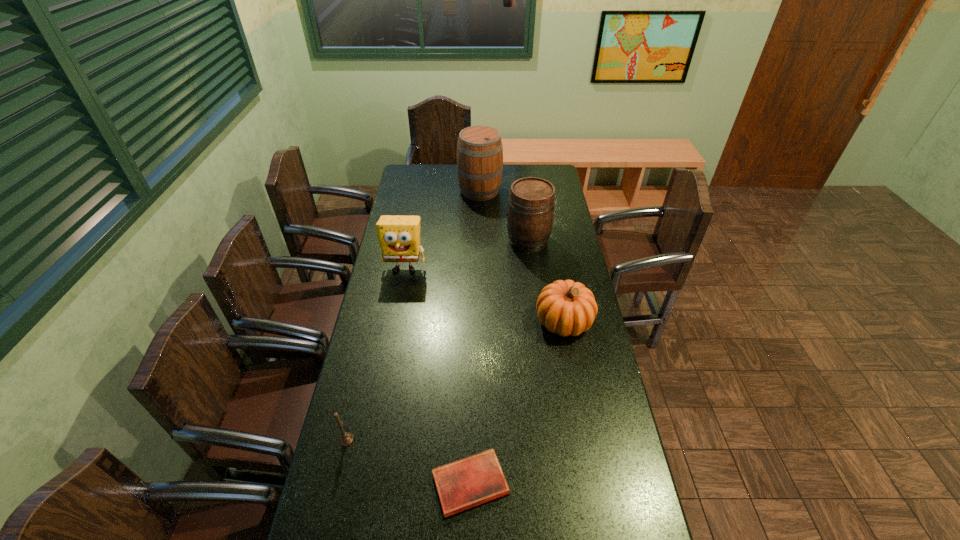
Where is `vacant space that satisfies the following two spatial constraints: 1. on the side of the second farthest object near the bung hole; 2. on the front side of the candle`? The height and width of the screenshot is (540, 960). vacant space that satisfies the following two spatial constraints: 1. on the side of the second farthest object near the bung hole; 2. on the front side of the candle is located at coordinates (553, 440).

Where is `vacant space that satisfies the following two spatial constraints: 1. on the side of the nearer cider near the bung hole; 2. on the face of the sponge`? The width and height of the screenshot is (960, 540). vacant space that satisfies the following two spatial constraints: 1. on the side of the nearer cider near the bung hole; 2. on the face of the sponge is located at coordinates (531, 268).

You are a GUI agent. You are given a task and a screenshot of the screen. Output one action in this format:
    pyautogui.click(x=<x>, y=<y>)
    Task: Click on the free space that satisfies the following two spatial constraints: 1. on the side of the right cider near the bung hole; 2. on the face of the third farthest object
    This screenshot has height=540, width=960.
    Given the screenshot: What is the action you would take?
    pyautogui.click(x=531, y=268)

Find the location of `vacant space that satisfies the following two spatial constraints: 1. on the side of the right cider near the bung hole; 2. on the back side of the fourth tallest object`. vacant space that satisfies the following two spatial constraints: 1. on the side of the right cider near the bung hole; 2. on the back side of the fourth tallest object is located at coordinates (539, 321).

At what (x,y) coordinates should I click in order to perform the action: click on blank area in the image that satisfies the following two spatial constraints: 1. on the face of the third farthest object; 2. on the right side of the fourth farthest object. Please return your answer as a coordinate pair (x, y). Image resolution: width=960 pixels, height=540 pixels. Looking at the image, I should click on (395, 321).

Where is `free point that satisfies the following two spatial constraints: 1. on the side of the fifth nearest object near the bung hole; 2. on the face of the third farthest object`? This screenshot has height=540, width=960. free point that satisfies the following two spatial constraints: 1. on the side of the fifth nearest object near the bung hole; 2. on the face of the third farthest object is located at coordinates (531, 268).

This screenshot has height=540, width=960. Find the location of `free space that satisfies the following two spatial constraints: 1. on the back side of the third nearest object; 2. on the side of the nearer cider near the bung hole`. free space that satisfies the following two spatial constraints: 1. on the back side of the third nearest object; 2. on the side of the nearer cider near the bung hole is located at coordinates (549, 241).